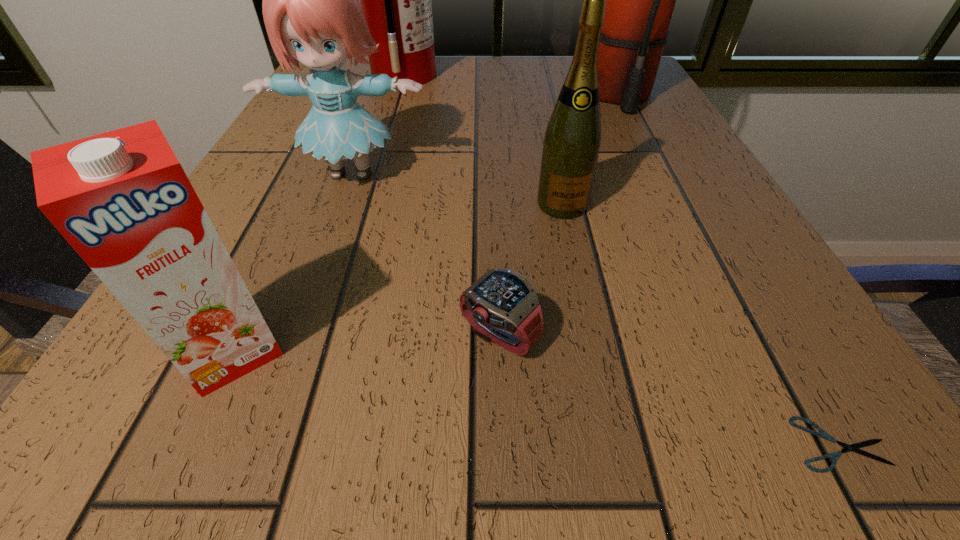
The width and height of the screenshot is (960, 540). I want to click on free location located on the nozzle of the right fire extinguisher, so click(x=657, y=171).

Image resolution: width=960 pixels, height=540 pixels. I want to click on free region located on the front-facing side of the doll, so click(297, 325).

What are the coordinates of `free point located 0.170m on the front-facing side of the third object from right to left` in the screenshot? It's located at (584, 308).

The height and width of the screenshot is (540, 960). In order to click on vacant space situated 0.060m on the right of the carton in this screenshot , I will do `click(339, 349)`.

Find the location of a particular element. free location located on the back of the sixth tallest object is located at coordinates (496, 257).

Where is `vacant space situated 0.300m on the back of the shears`? This screenshot has width=960, height=540. vacant space situated 0.300m on the back of the shears is located at coordinates (713, 226).

Where is `carton situated at the near edge`? carton situated at the near edge is located at coordinates (122, 200).

Find the location of a particular element. shears that is at the near edge is located at coordinates (834, 456).

Identify the location of fire extinguisher at the left edge. (395, 0).

In order to click on doll positioned at the left edge in this screenshot , I will do `click(312, 15)`.